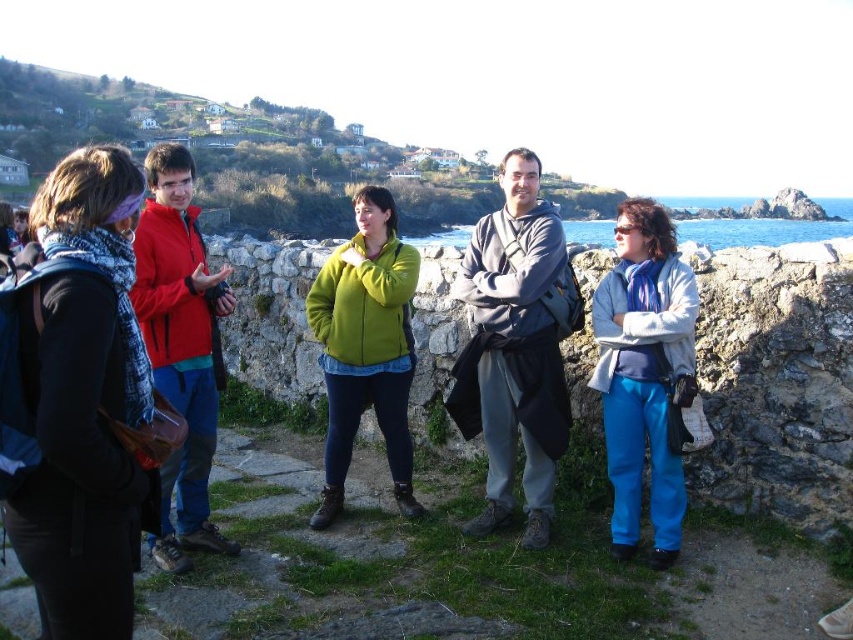
Question: Which point is closer to the camera taking this photo?

Choices:
 (A) (381, 384)
 (B) (170, 394)
 (C) (645, 435)
 (D) (125, 296)

Answer: (D)

Question: Is gray hoodie at center below green fleece jacket at center?

Choices:
 (A) no
 (B) yes

Answer: (A)

Question: Which point is farther from the camera taking this photo?

Choices:
 (A) (326, 348)
 (B) (527, 500)

Answer: (A)

Question: Among these points, which one is nearest to the camera?

Choices:
 (A) (67, 344)
 (B) (642, 218)
 (C) (183, 340)
 (D) (407, 396)

Answer: (A)

Question: Can you confirm if blue fabric pants at center is positioned below red jacket at left?

Choices:
 (A) no
 (B) yes

Answer: (B)

Question: Is blue scarf at left behind green fleece jacket at center?

Choices:
 (A) no
 (B) yes

Answer: (A)